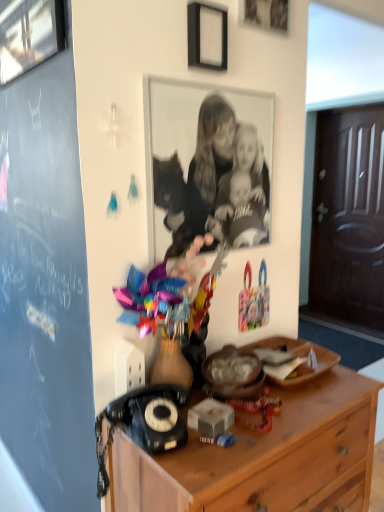
The width and height of the screenshot is (384, 512). I want to click on free space in front of metallic silver toy at center, so click(217, 452).